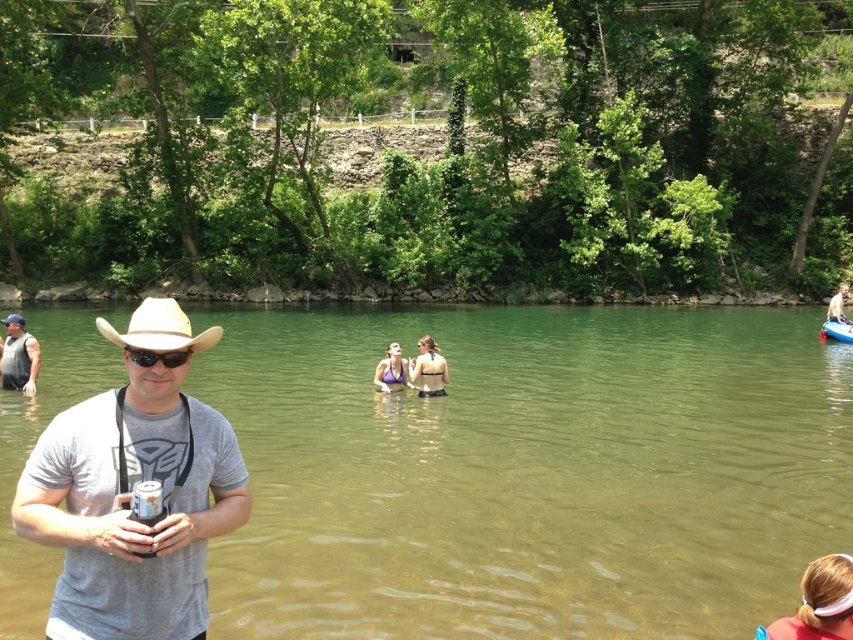
Is clear water at center shorter than white plastic canoe at upper right?

No, clear water at center is not shorter than white plastic canoe at upper right.

Consider the image. Is the position of clear water at center more distant than that of white plastic canoe at upper right?

No.

Between point (767, 579) and point (833, 333), which one is positioned behind?

Positioned behind is point (833, 333).

Image resolution: width=853 pixels, height=640 pixels. What are the coordinates of `clear water at center` in the screenshot? It's located at (527, 472).

Can you confirm if gray cotton t-shirt at left is wider than matte gray shirt at center?

Yes.

From the picture: Does gray cotton t-shirt at left come in front of matte gray shirt at center?

Yes, it is in front of matte gray shirt at center.

Does point (201, 426) come farther from viewer compared to point (22, 332)?

That is False.

Where is `gray cotton t-shirt at left`? This screenshot has width=853, height=640. gray cotton t-shirt at left is located at coordinates (129, 499).

Is matte black bikini at center positioned behind purple fabric bikini at center?

That is False.

Does point (439, 358) lie behind point (392, 381)?

Yes, it is behind point (392, 381).

Does point (428, 381) lie behind point (379, 365)?

No.

You are a GUI agent. You are given a task and a screenshot of the screen. Output one action in this format:
    pyautogui.click(x=<x>, y=<y>)
    Task: Click on the matte black bikini at center
    This screenshot has width=853, height=640.
    Given the screenshot: What is the action you would take?
    pyautogui.click(x=428, y=369)